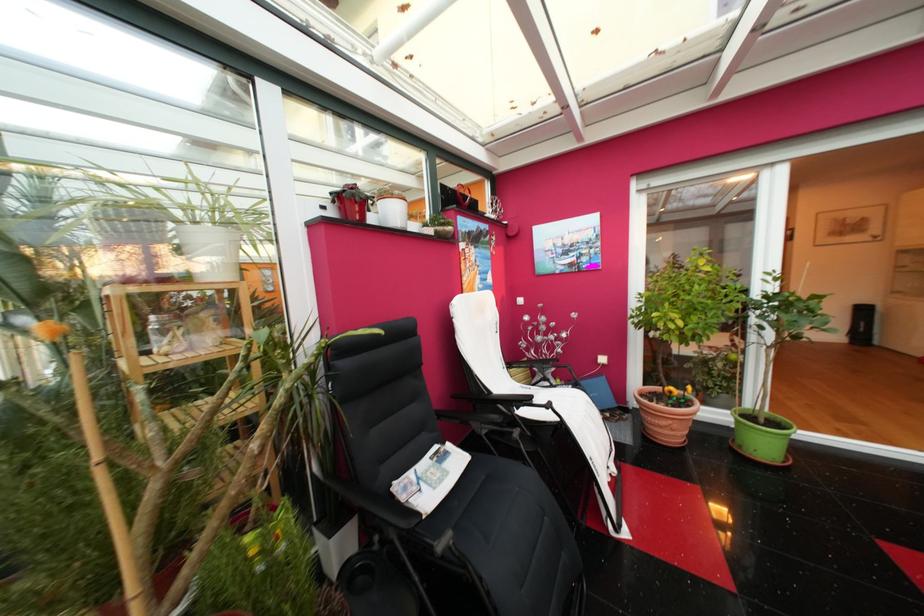
Find where to sit the white chair sitting surface. Please return your answer as a coordinate pair (x, y).

(552, 400)